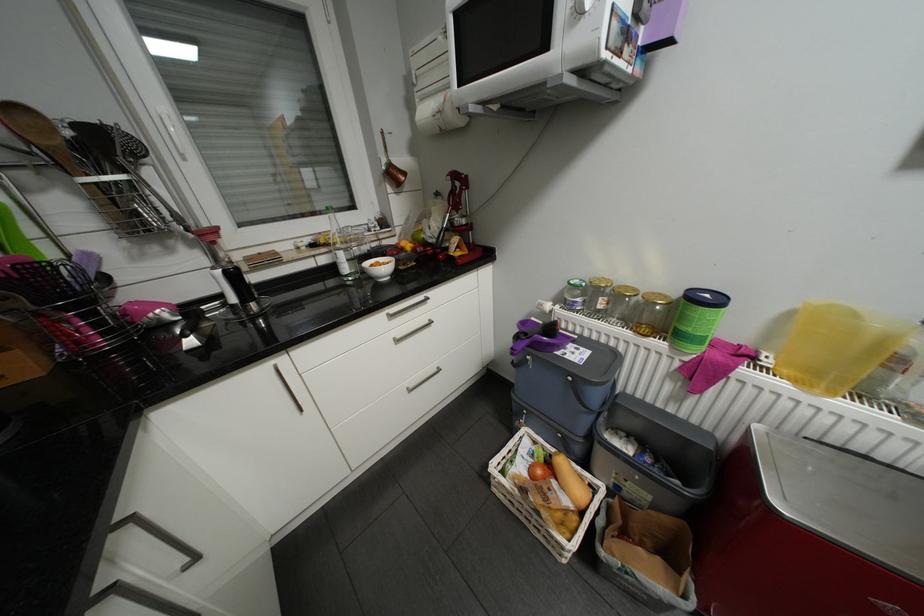
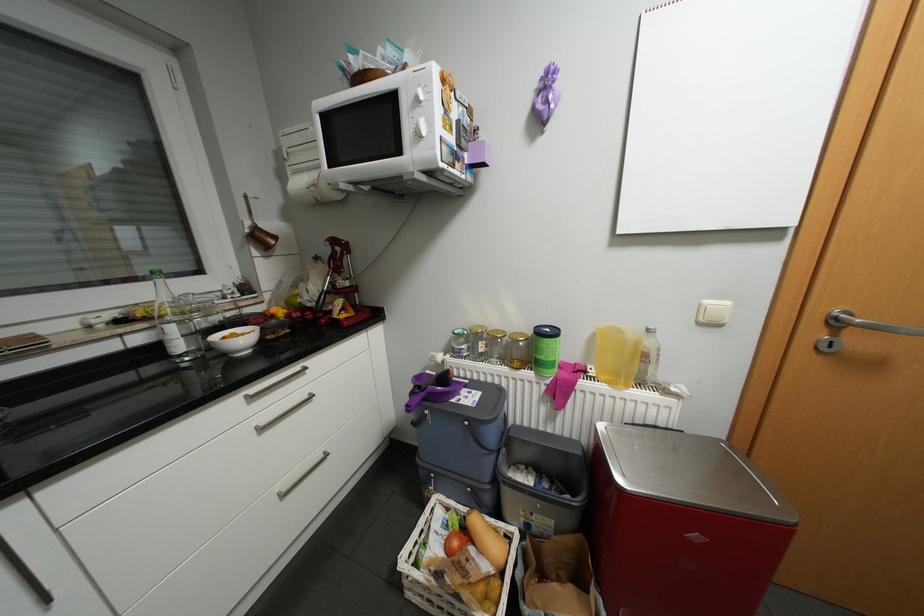
The point at [430,99] is marked in the first image. Where is the corresponding point in the second image?

(302, 172)